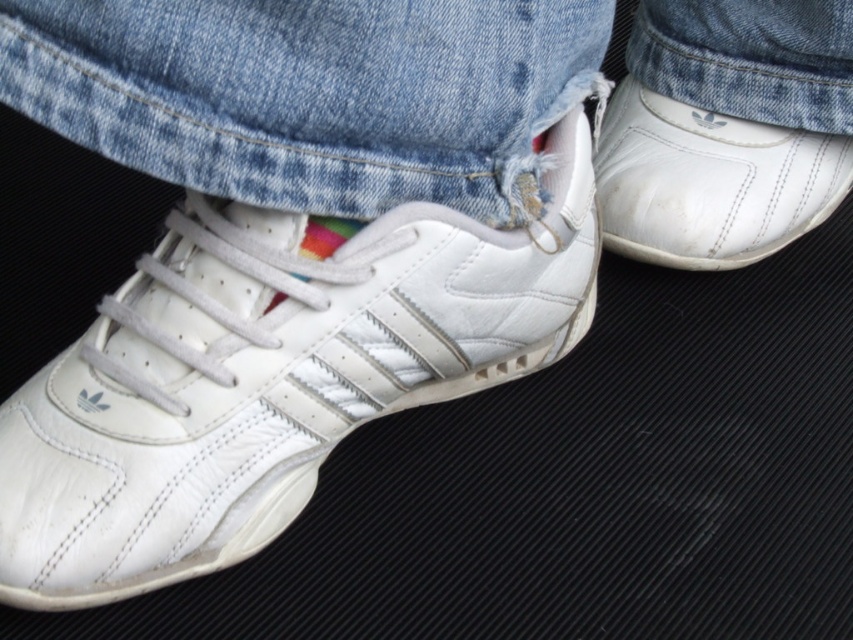
You are trying to determine if the white leather sneaker at lower left can fit into a space that is the same width as the denim at center. Based on the image, will it fit?

The white leather sneaker at lower left is wider than the denim at center, so it will not fit into a space that matches the denim at center width.

You are trying to determine if the denim at center can cover the white leather shoe at right completely. Based on their heights, is this possible?

The denim at center is not as tall as the white leather shoe at right, so it cannot cover it completely.

Based on the scene description, can you determine if the denim at center is wider than the white leather shoe at right?

The denim at center might be wider than white leather shoe at right according to the description.